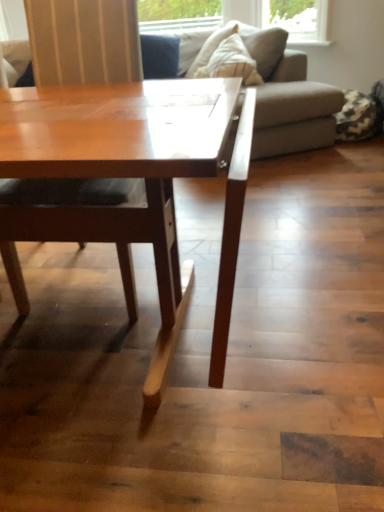
Question: Considering the relative sizes of matte wood chair at center and gray fabric couch at upper center in the image provided, is matte wood chair at center smaller than gray fabric couch at upper center?

Choices:
 (A) no
 (B) yes

Answer: (B)

Question: From a real-world perspective, does matte wood chair at center stand above gray fabric couch at upper center?

Choices:
 (A) yes
 (B) no

Answer: (A)

Question: Is matte wood chair at center positioned with its back to gray fabric couch at upper center?

Choices:
 (A) no
 (B) yes

Answer: (B)

Question: Is matte wood chair at center to the left of gray fabric couch at upper center from the viewer's perspective?

Choices:
 (A) yes
 (B) no

Answer: (A)

Question: Is matte wood chair at center not near gray fabric couch at upper center?

Choices:
 (A) yes
 (B) no

Answer: (A)

Question: Is matte wood chair at center positioned in front of gray fabric couch at upper center?

Choices:
 (A) no
 (B) yes

Answer: (B)

Question: Considering the relative sizes of gray fabric couch at upper center and matte wood chair at center in the image provided, is gray fabric couch at upper center wider than matte wood chair at center?

Choices:
 (A) yes
 (B) no

Answer: (A)

Question: From a real-world perspective, is gray fabric couch at upper center below matte wood chair at center?

Choices:
 (A) yes
 (B) no

Answer: (A)

Question: Is gray fabric couch at upper center oriented towards matte wood chair at center?

Choices:
 (A) yes
 (B) no

Answer: (B)

Question: Is gray fabric couch at upper center positioned behind matte wood chair at center?

Choices:
 (A) yes
 (B) no

Answer: (A)

Question: Can you confirm if gray fabric couch at upper center is positioned to the left of matte wood chair at center?

Choices:
 (A) no
 (B) yes

Answer: (A)

Question: From a real-world perspective, is gray fabric couch at upper center located higher than matte wood chair at center?

Choices:
 (A) yes
 (B) no

Answer: (B)

Question: Based on their sizes in the image, would you say gray fabric couch at upper center is bigger or smaller than matte wood chair at center?

Choices:
 (A) big
 (B) small

Answer: (A)